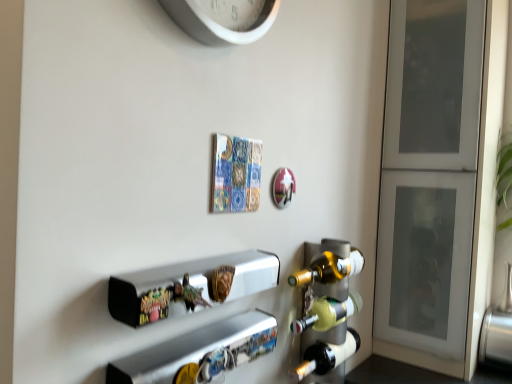
Question: Considering the relative positions of white plastic clock at upper center and matte glass wine rack at right in the image provided, is white plastic clock at upper center behind matte glass wine rack at right?

Choices:
 (A) no
 (B) yes

Answer: (A)

Question: Does white plastic clock at upper center have a greater width compared to matte glass wine rack at right?

Choices:
 (A) yes
 (B) no

Answer: (B)

Question: Does white plastic clock at upper center have a lesser height compared to matte glass wine rack at right?

Choices:
 (A) yes
 (B) no

Answer: (A)

Question: Is white plastic clock at upper center oriented towards matte glass wine rack at right?

Choices:
 (A) yes
 (B) no

Answer: (B)

Question: Does white plastic clock at upper center contain matte glass wine rack at right?

Choices:
 (A) yes
 (B) no

Answer: (B)

Question: Is white plastic clock at upper center closer to the viewer compared to matte glass wine rack at right?

Choices:
 (A) yes
 (B) no

Answer: (A)

Question: Is white frosted glass cabinet at right at the back of metallic silver shelf at center, the first shelf viewed from the top?

Choices:
 (A) no
 (B) yes

Answer: (A)

Question: From a real-world perspective, is metallic silver shelf at center, the second shelf from the bottom, on top of white frosted glass cabinet at right?

Choices:
 (A) yes
 (B) no

Answer: (B)

Question: From the image's perspective, is metallic silver shelf at center, the second shelf from the bottom, beneath white frosted glass cabinet at right?

Choices:
 (A) yes
 (B) no

Answer: (A)

Question: Is metallic silver shelf at center, the first shelf viewed from the top, at the right side of white frosted glass cabinet at right?

Choices:
 (A) no
 (B) yes

Answer: (A)

Question: Would you say metallic silver shelf at center, the first shelf viewed from the top, contains white frosted glass cabinet at right?

Choices:
 (A) yes
 (B) no

Answer: (B)

Question: Is metallic silver shelf at center, the first shelf viewed from the top, aimed at white frosted glass cabinet at right?

Choices:
 (A) yes
 (B) no

Answer: (B)

Question: From a real-world perspective, is metallic silver shelf at lower center, acting as the 1th shelf starting from the bottom, positioned under matte glass wine rack at right based on gravity?

Choices:
 (A) yes
 (B) no

Answer: (B)